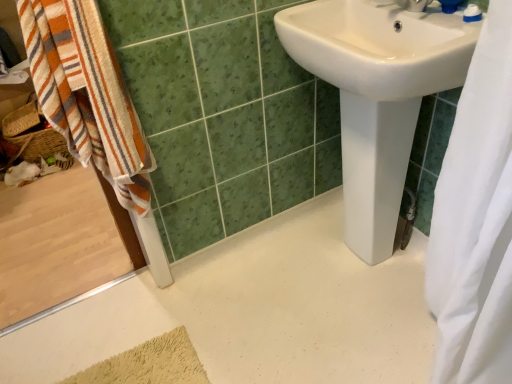
Describe the element at coordinates (87, 94) in the screenshot. I see `striped cotton towel at left` at that location.

Describe the element at coordinates (377, 95) in the screenshot. I see `white glossy sink at center` at that location.

Locate an element on the screen. The image size is (512, 384). white plastic toothpaste tube at upper right is located at coordinates click(472, 13).

Are white plastic toothpaste tube at upper right and striped cotton towel at left located far from each other?

No, white plastic toothpaste tube at upper right is not far away from striped cotton towel at left.

Is point (468, 5) closer to camera compared to point (49, 59)?

No, it is not.

Relative to striped cotton towel at left, is white plastic toothpaste tube at upper right in front or behind?

white plastic toothpaste tube at upper right is positioned farther from the viewer than striped cotton towel at left.

Can you tell me how much striped cotton towel at left and white glossy sink at center differ in facing direction?

The angular difference between striped cotton towel at left and white glossy sink at center is 87.1 degrees.

Are striped cotton towel at left and white glossy sink at center located far from each other?

striped cotton towel at left is near white glossy sink at center, not far away.

Is striped cotton towel at left thinner than white glossy sink at center?

Yes, striped cotton towel at left is thinner than white glossy sink at center.

Based on the photo, from the image's perspective, is striped cotton towel at left positioned above or below white glossy sink at center?

From the image's perspective, striped cotton towel at left appears above white glossy sink at center.

Are white glossy sink at center and white glossy faucet at upper right making contact?

No, white glossy sink at center is not beside white glossy faucet at upper right.

Considering the relative sizes of white glossy sink at center and white glossy faucet at upper right in the image provided, is white glossy sink at center thinner than white glossy faucet at upper right?

In fact, white glossy sink at center might be wider than white glossy faucet at upper right.

Which object is closer to the camera, white glossy sink at center or white glossy faucet at upper right?

white glossy sink at center is in front.

Could you tell me if white glossy sink at center is turned towards white glossy faucet at upper right?

No, white glossy sink at center is not aimed at white glossy faucet at upper right.

Does white plastic toothpaste tube at upper right have a lesser height compared to white glossy faucet at upper right?

Yes.

Is white plastic toothpaste tube at upper right far from white glossy faucet at upper right?

No, there isn't a large distance between white plastic toothpaste tube at upper right and white glossy faucet at upper right.

Is white plastic toothpaste tube at upper right positioned beyond the bounds of white glossy sink at center?

Absolutely, white plastic toothpaste tube at upper right is external to white glossy sink at center.

Is white plastic toothpaste tube at upper right wider than white glossy sink at center?

Incorrect, the width of white plastic toothpaste tube at upper right does not surpass that of white glossy sink at center.

Is white plastic toothpaste tube at upper right aimed at white glossy sink at center?

Yes, white plastic toothpaste tube at upper right is aimed at white glossy sink at center.

From a real-world perspective, which is physically below, white plastic toothpaste tube at upper right or white glossy sink at center?

From a 3D spatial view, white glossy sink at center is below.

From the image's perspective, is white glossy sink at center located above striped cotton towel at left?

No, from the image's perspective, white glossy sink at center is not over striped cotton towel at left.

Find the location of `beach towel that appears on the left of white glossy sink at center`. beach towel that appears on the left of white glossy sink at center is located at coordinates (87, 94).

From the picture: From a real-world perspective, who is located higher, white glossy sink at center or striped cotton towel at left?

From a 3D spatial view, striped cotton towel at left is above.

Is the depth of white glossy sink at center greater than that of striped cotton towel at left?

Yes, the depth of white glossy sink at center is greater than that of striped cotton towel at left.

Is the depth of white glossy sink at center less than that of white fabric shower curtain at right?

No, white glossy sink at center is further to the viewer.

Would you say white glossy sink at center is to the left or to the right of white fabric shower curtain at right in the picture?

Clearly, white glossy sink at center is on the left of white fabric shower curtain at right in the image.

Are white glossy sink at center and white fabric shower curtain at right making contact?

They are not placed beside each other.

In order to click on toiletry on the right of striped cotton towel at left in this screenshot , I will do `click(472, 13)`.

In the image, there is a white glossy sink at center. Where is `beach towel above it (from the image's perspective)`? beach towel above it (from the image's perspective) is located at coordinates (87, 94).

Which object lies nearer to the anchor point white glossy sink at center, striped cotton towel at left or white plastic toothpaste tube at upper right?

Among the two, white plastic toothpaste tube at upper right is located nearer to white glossy sink at center.

From the image, which object appears to be farther from striped cotton towel at left, white plastic toothpaste tube at upper right or white glossy sink at center?

Based on the image, white plastic toothpaste tube at upper right appears to be further to striped cotton towel at left.

Consider the image. From the image, which object appears to be farther from white glossy faucet at upper right, white glossy sink at center or striped cotton towel at left?

Based on the image, striped cotton towel at left appears to be further to white glossy faucet at upper right.

Looking at the image, which one is located closer to white glossy sink at center, white plastic toothpaste tube at upper right or white fabric shower curtain at right?

white fabric shower curtain at right is closer to white glossy sink at center.

Considering their positions, is white plastic toothpaste tube at upper right positioned closer to white glossy sink at center than striped cotton towel at left?

white plastic toothpaste tube at upper right is closer to white glossy sink at center.

Considering their positions, is striped cotton towel at left positioned closer to white fabric shower curtain at right than white glossy sink at center?

Among the two, white glossy sink at center is located nearer to white fabric shower curtain at right.

Which object lies nearer to the anchor point white glossy sink at center, white fabric shower curtain at right or striped cotton towel at left?

Based on the image, white fabric shower curtain at right appears to be nearer to white glossy sink at center.

Estimate the real-world distances between objects in this image. Which object is further from white fabric shower curtain at right, striped cotton towel at left or white glossy faucet at upper right?

The object further to white fabric shower curtain at right is striped cotton towel at left.

Locate an element on the screen. The height and width of the screenshot is (384, 512). sink between striped cotton towel at left and white fabric shower curtain at right in the horizontal direction is located at coordinates (377, 95).

Locate an element on the screen. sink situated between striped cotton towel at left and white glossy faucet at upper right from left to right is located at coordinates (377, 95).

Where is `sink between striped cotton towel at left and white plastic toothpaste tube at upper right in the horizontal direction`? This screenshot has width=512, height=384. sink between striped cotton towel at left and white plastic toothpaste tube at upper right in the horizontal direction is located at coordinates (377, 95).

Where is `sink between white plastic toothpaste tube at upper right and white fabric shower curtain at right from top to bottom`? sink between white plastic toothpaste tube at upper right and white fabric shower curtain at right from top to bottom is located at coordinates (377, 95).